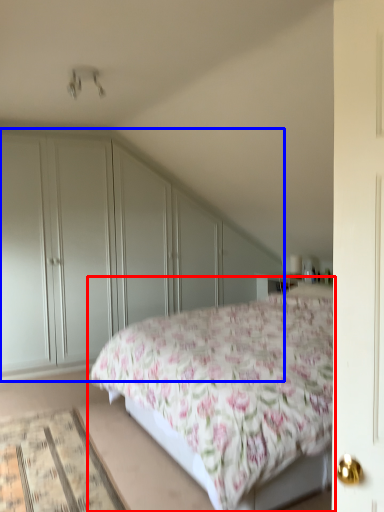
Question: Which point is further to the camera, bed (highlighted by a red box) or dresser (highlighted by a blue box)?

Choices:
 (A) bed
 (B) dresser

Answer: (B)